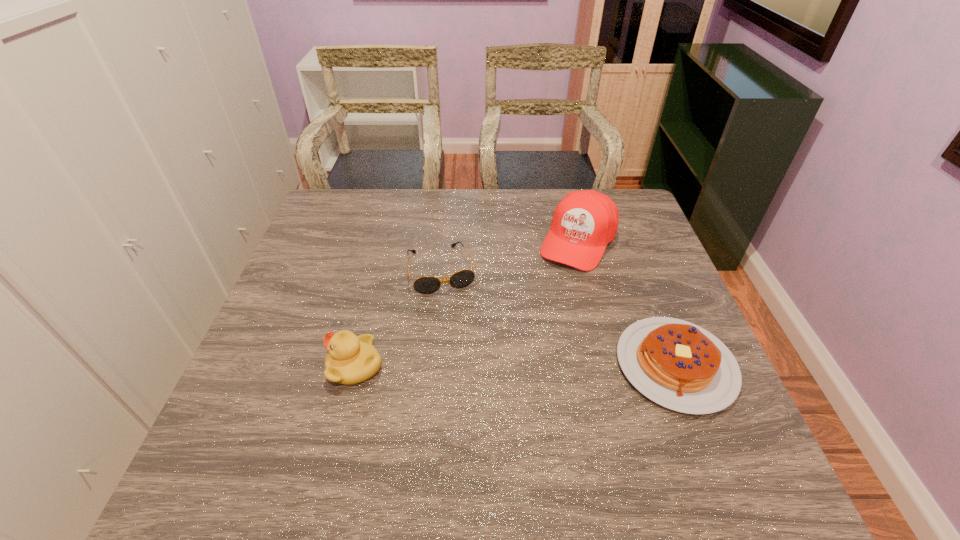
Locate an element on the screen. Image resolution: width=960 pixels, height=540 pixels. duckling is located at coordinates (351, 360).

Find the location of `the leftmost object`. the leftmost object is located at coordinates (351, 360).

Find the location of a particular element. This screenshot has width=960, height=540. pancake is located at coordinates [x=677, y=364].

The width and height of the screenshot is (960, 540). Identify the location of the tallest object. (584, 222).

Locate an element on the screen. the third object from right to left is located at coordinates (428, 284).

Find the location of `vacant space situated on the front-facing side of the leftmost object`. vacant space situated on the front-facing side of the leftmost object is located at coordinates (260, 366).

Image resolution: width=960 pixels, height=540 pixels. Find the location of `free point located 0.100m on the front-facing side of the leftmost object`. free point located 0.100m on the front-facing side of the leftmost object is located at coordinates 282,366.

This screenshot has width=960, height=540. I want to click on vacant space located 0.090m on the front-facing side of the leftmost object, so click(287, 366).

The width and height of the screenshot is (960, 540). I want to click on vacant space located on the left of the pancake, so click(x=489, y=365).

Locate an element on the screen. The width and height of the screenshot is (960, 540). vacant space located 0.310m on the front panel of the baseball cap is located at coordinates (517, 347).